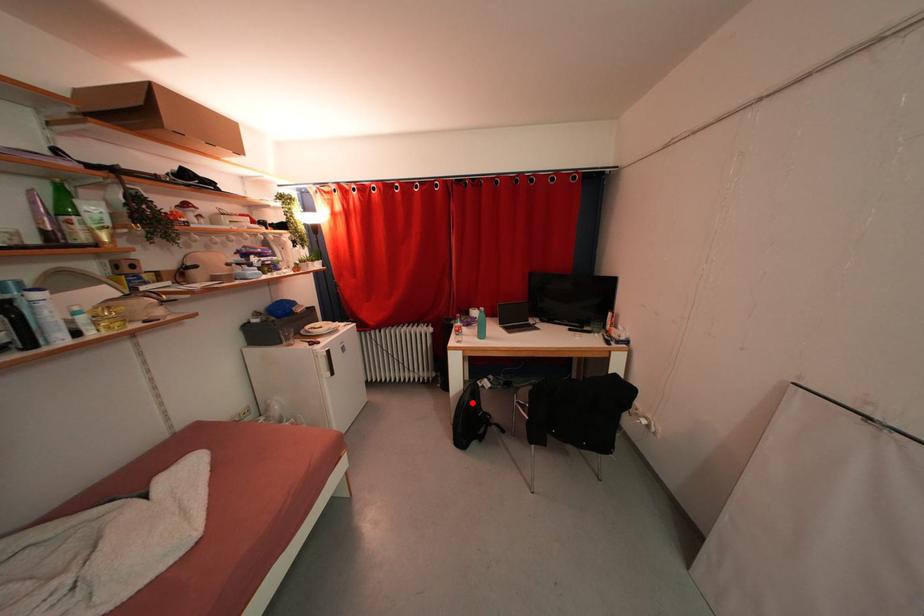
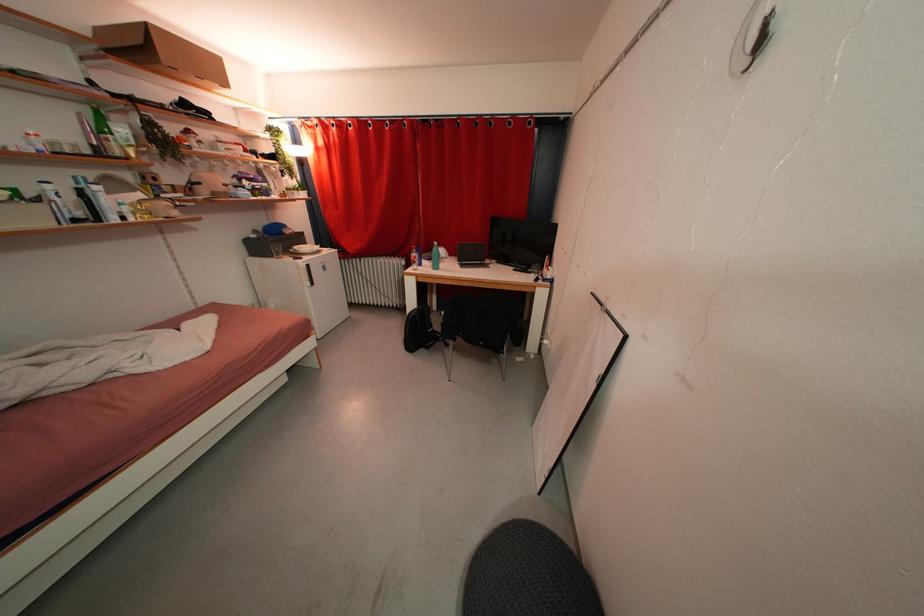
Where in the second image is the point corresponding to the highlighted location from the first image?

(419, 317)